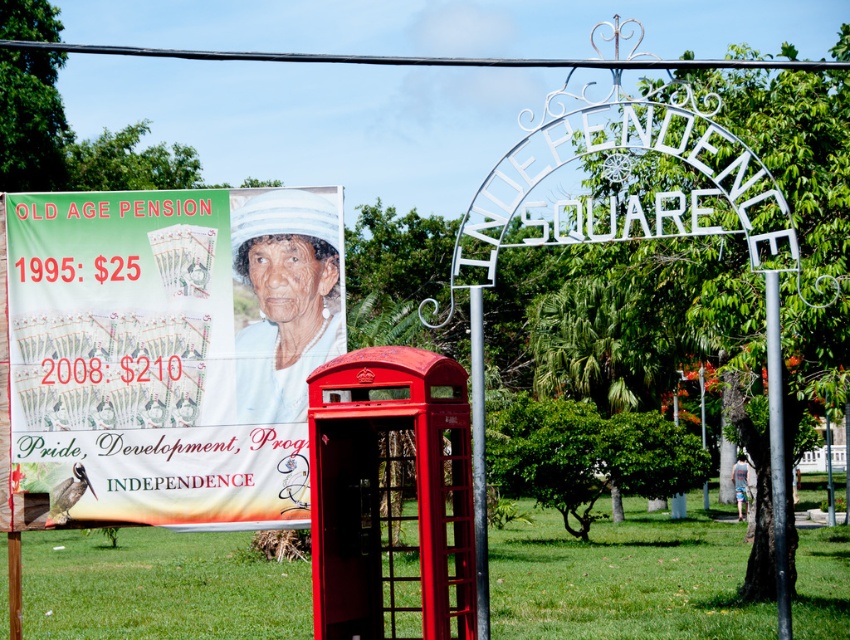
Does matte plastic poster at upper left appear under silver metallic pole at center?

Actually, matte plastic poster at upper left is above silver metallic pole at center.

Which is above, matte plastic poster at upper left or silver metallic pole at center?

matte plastic poster at upper left is higher up.

Is point (166, 417) in front of point (480, 554)?

No, it is not.

What are the coordinates of `matte plastic poster at upper left` in the screenshot? It's located at (170, 349).

Is point (367, 566) farther from camera compared to point (785, 625)?

That is True.

Is shiny red phone box at center bigger than black metallic pole at center?

Indeed, shiny red phone box at center has a larger size compared to black metallic pole at center.

Is point (343, 632) in front of point (779, 632)?

No, it is behind (779, 632).

Where is `shiny red phone box at center`? This screenshot has width=850, height=640. shiny red phone box at center is located at coordinates (391, 497).

At what (x,y) coordinates should I click in order to perform the action: click on matte plastic poster at upper left. Please return your answer as a coordinate pair (x, y). Looking at the image, I should click on (170, 349).

Can you confirm if matte plastic poster at upper left is positioned to the left of black metallic pole at center?

Yes, matte plastic poster at upper left is to the left of black metallic pole at center.

I want to click on matte plastic poster at upper left, so click(170, 349).